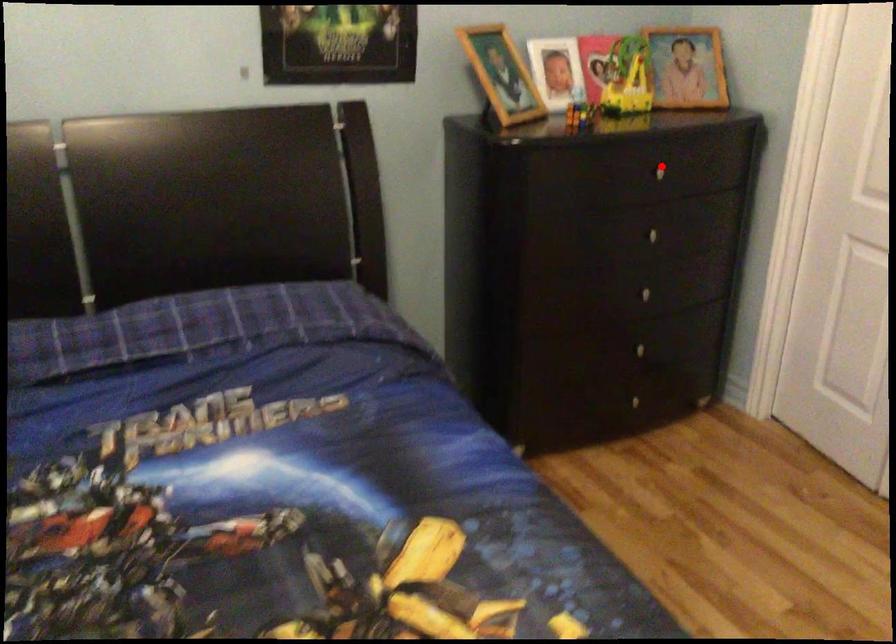
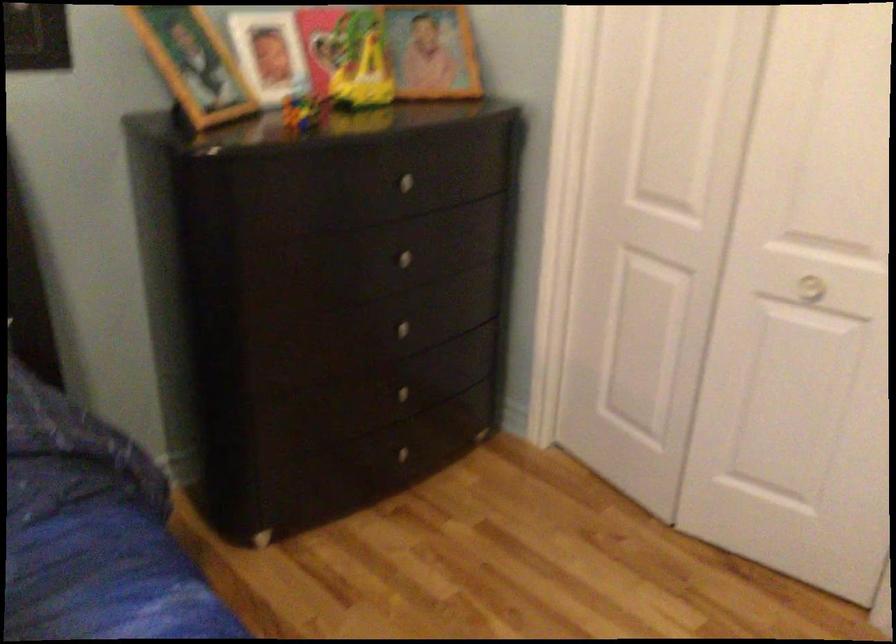
The point at the highlighted location is marked in the first image. Where is the corresponding point in the second image?

(408, 178)